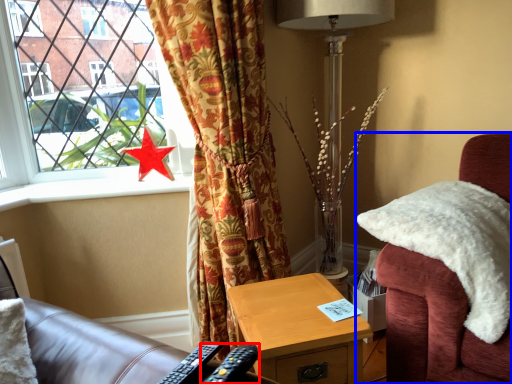
Question: Which object appears closest to the camera in this image, remote control (highlighted by a red box) or chair (highlighted by a blue box)?

Choices:
 (A) remote control
 (B) chair

Answer: (A)